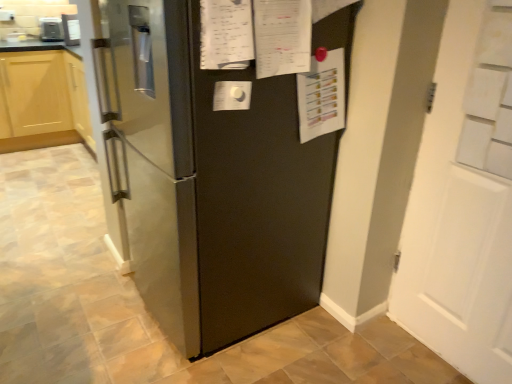
What are the coordinates of `vacant space positioned to the left of satin black refrigerator at center` in the screenshot? It's located at (70, 300).